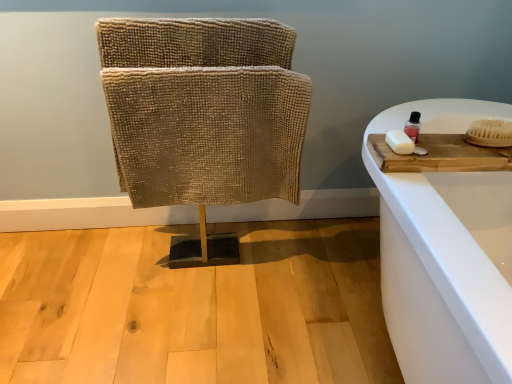
What is the approximate height of white matte soap at right?

The height of white matte soap at right is 1.21 inches.

Describe the element at coordinates (203, 117) in the screenshot. I see `beige textured fabric at center` at that location.

Find the location of `transparent plastic bottle at upper right`. transparent plastic bottle at upper right is located at coordinates (413, 126).

Is transparent plastic bottle at upper right at the left side of white bristle brush at right?

Yes, transparent plastic bottle at upper right is to the left of white bristle brush at right.

Does point (414, 124) come farther from viewer compared to point (470, 132)?

Yes, point (414, 124) is farther from viewer.

How much distance is there between transparent plastic bottle at upper right and white bristle brush at right?

transparent plastic bottle at upper right and white bristle brush at right are 6.41 inches apart from each other.

From the image's perspective, is transparent plastic bottle at upper right located above or below white bristle brush at right?

transparent plastic bottle at upper right is situated higher than white bristle brush at right in the image.

Can you confirm if white matte soap at right is smaller than wooden cutting board at right?

Correct, white matte soap at right occupies less space than wooden cutting board at right.

Considering the positions of objects white matte soap at right and wooden cutting board at right in the image provided, who is more to the right, white matte soap at right or wooden cutting board at right?

wooden cutting board at right.

Is white matte soap at right taller or shorter than wooden cutting board at right?

Clearly, white matte soap at right is shorter compared to wooden cutting board at right.

How different are the orientations of white matte soap at right and wooden cutting board at right in degrees?

The angular difference between white matte soap at right and wooden cutting board at right is 0.881 degrees.

In the scene shown: Are white bristle brush at right and wooden cutting board at right located far from each other?

They are positioned close to each other.

Looking at this image, between white bristle brush at right and wooden cutting board at right, which one has less height?

Standing shorter between the two is wooden cutting board at right.

Choose the correct answer: Is white bristle brush at right inside wooden cutting board at right or outside it?

white bristle brush at right is located beyond the bounds of wooden cutting board at right.

Is white bristle brush at right further to the viewer compared to transparent plastic bottle at upper right?

That is False.

Does white bristle brush at right have a smaller size compared to transparent plastic bottle at upper right?

Actually, white bristle brush at right might be larger than transparent plastic bottle at upper right.

Consider the image. Considering the relative sizes of white bristle brush at right and transparent plastic bottle at upper right in the image provided, is white bristle brush at right wider than transparent plastic bottle at upper right?

Indeed, white bristle brush at right has a greater width compared to transparent plastic bottle at upper right.

From the image's perspective, is white bristle brush at right over transparent plastic bottle at upper right?

Actually, white bristle brush at right appears below transparent plastic bottle at upper right in the image.

Would you say transparent plastic bottle at upper right is to the left or to the right of white matte soap at right in the picture?

Clearly, transparent plastic bottle at upper right is on the right of white matte soap at right in the image.

Which object is thinner, transparent plastic bottle at upper right or white matte soap at right?

With smaller width is transparent plastic bottle at upper right.

From the image's perspective, which object appears higher, transparent plastic bottle at upper right or white matte soap at right?

From the image's view, transparent plastic bottle at upper right is above.

From the picture: In the image, is wooden cutting board at right positioned in front of or behind transparent plastic bottle at upper right?

wooden cutting board at right is positioned closer to the viewer than transparent plastic bottle at upper right.

From the image's perspective, would you say wooden cutting board at right is shown under transparent plastic bottle at upper right?

Yes, from the image's perspective, wooden cutting board at right is beneath transparent plastic bottle at upper right.

Which object is wider, wooden cutting board at right or transparent plastic bottle at upper right?

With larger width is wooden cutting board at right.

Between wooden cutting board at right and transparent plastic bottle at upper right, which one has smaller size?

With smaller size is transparent plastic bottle at upper right.

What's the angular difference between white matte soap at right and transparent plastic bottle at upper right's facing directions?

They differ by 0.00114 degrees in their facing directions.

Considering the points (412, 147) and (417, 112), which point is behind, point (412, 147) or point (417, 112)?

Positioned behind is point (417, 112).

Can you confirm if white matte soap at right is smaller than transparent plastic bottle at upper right?

Incorrect, white matte soap at right is not smaller in size than transparent plastic bottle at upper right.

Considering the sizes of objects white matte soap at right and transparent plastic bottle at upper right in the image provided, who is wider, white matte soap at right or transparent plastic bottle at upper right?

Wider between the two is white matte soap at right.

Identify the location of toiletry that is on the left side of white bristle brush at right. (413, 126).

In order to click on soap that is in front of the wooden cutting board at right in this screenshot , I will do `click(399, 142)`.

Estimate the real-world distances between objects in this image. Which object is closer to transparent plastic bottle at upper right, beige textured fabric at center or white bristle brush at right?

white bristle brush at right lies closer to transparent plastic bottle at upper right than the other object.

When comparing their distances from wooden cutting board at right, does beige textured fabric at center or white matte soap at right seem closer?

Based on the image, white matte soap at right appears to be nearer to wooden cutting board at right.

From the image, which object appears to be farther from wooden cutting board at right, white matte soap at right or transparent plastic bottle at upper right?

white matte soap at right lies further to wooden cutting board at right than the other object.

Which object lies further to the anchor point beige textured fabric at center, wooden cutting board at right or white matte soap at right?

white matte soap at right lies further to beige textured fabric at center than the other object.

Consider the image. Looking at the image, which one is located closer to white bristle brush at right, transparent plastic bottle at upper right or white matte soap at right?

transparent plastic bottle at upper right.

Which object lies further to the anchor point transparent plastic bottle at upper right, wooden cutting board at right or white matte soap at right?

wooden cutting board at right is further to transparent plastic bottle at upper right.

Which object lies further to the anchor point wooden cutting board at right, white bristle brush at right or transparent plastic bottle at upper right?

white bristle brush at right.

Based on their spatial positions, is white bristle brush at right or transparent plastic bottle at upper right closer to white matte soap at right?

The object closer to white matte soap at right is transparent plastic bottle at upper right.

Identify the location of toiletry between beige textured fabric at center and white bristle brush at right in the horizontal direction. (413, 126).

You are a GUI agent. You are given a task and a screenshot of the screen. Output one action in this format:
    pyautogui.click(x=<x>, y=<y>)
    Task: Click on the soap between beige textured fabric at center and wooden cutting board at right from left to right
    The width and height of the screenshot is (512, 384).
    Given the screenshot: What is the action you would take?
    pyautogui.click(x=399, y=142)

Locate an element on the screen. The height and width of the screenshot is (384, 512). soap between beige textured fabric at center and white bristle brush at right from left to right is located at coordinates (399, 142).

This screenshot has width=512, height=384. What are the coordinates of `wood situated between white matte soap at right and white bristle brush at right from left to right` in the screenshot? It's located at pos(440,155).